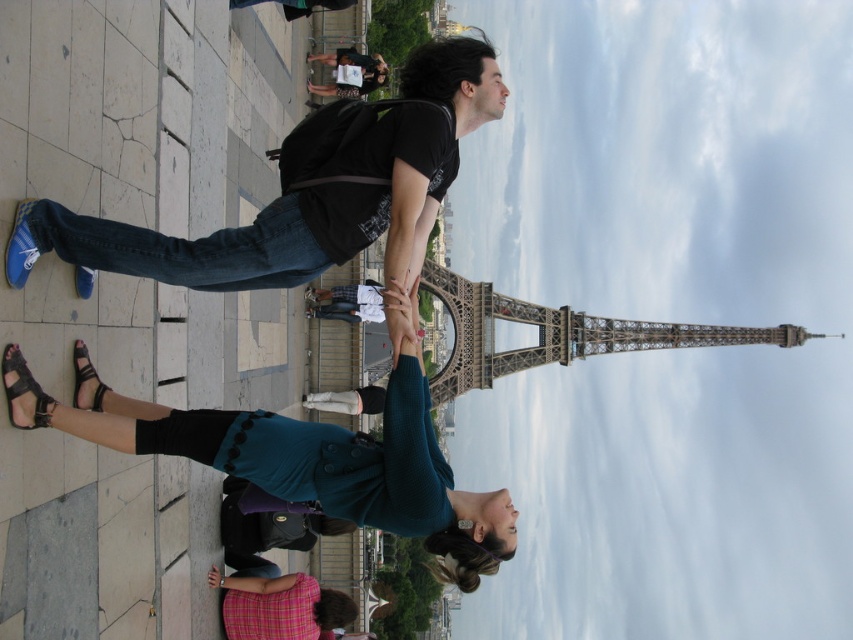
Who is higher up, teal fabric sweater at lower center or gray metal eiffel tower at center?

gray metal eiffel tower at center is above.

Which is in front, point (421, 445) or point (589, 355)?

Positioned in front is point (421, 445).

You are a GUI agent. You are given a task and a screenshot of the screen. Output one action in this format:
    pyautogui.click(x=<x>, y=<y>)
    Task: Click on the teal fabric sweater at lower center
    This screenshot has height=640, width=853.
    Given the screenshot: What is the action you would take?
    pyautogui.click(x=299, y=458)

Does blue denim jeans at left appear under pink plaid shirt at lower center?

Incorrect, blue denim jeans at left is not positioned below pink plaid shirt at lower center.

Between blue denim jeans at left and pink plaid shirt at lower center, which one is positioned higher?

blue denim jeans at left

Who is more distant from viewer, (350,145) or (328,593)?

Positioned behind is point (328,593).

Where is `blue denim jeans at left`? This screenshot has height=640, width=853. blue denim jeans at left is located at coordinates (306, 192).

Which is above, teal fabric sweater at lower center or pink plaid shirt at lower center?

teal fabric sweater at lower center is higher up.

Can you confirm if teal fabric sweater at lower center is positioned above pink plaid shirt at lower center?

Yes, teal fabric sweater at lower center is above pink plaid shirt at lower center.

Image resolution: width=853 pixels, height=640 pixels. Identify the location of teal fabric sweater at lower center. (299, 458).

The width and height of the screenshot is (853, 640). In order to click on teal fabric sweater at lower center in this screenshot , I will do `click(299, 458)`.